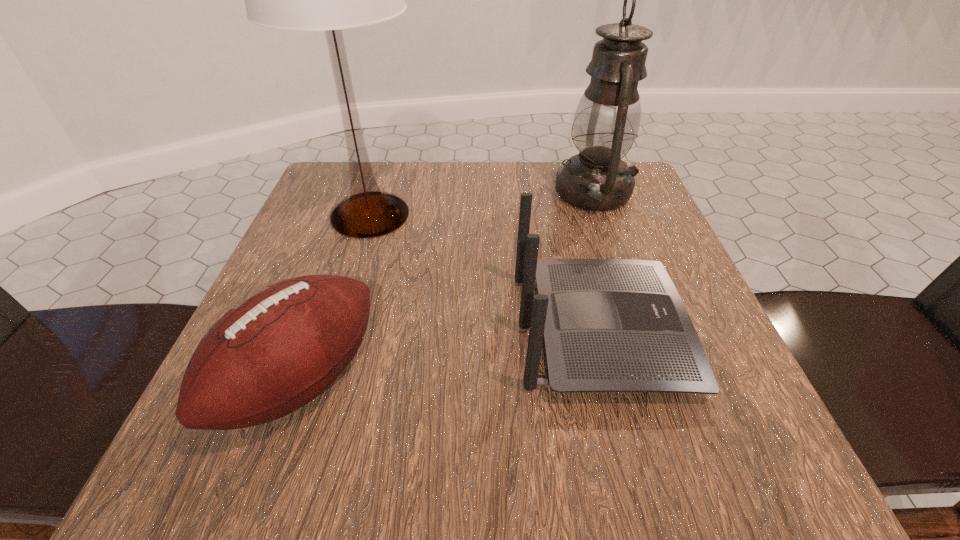
At what (x,y) coordinates should I click in order to perform the action: click on the tallest object. Please return your answer as a coordinate pair (x, y). Looking at the image, I should click on (329, 0).

The height and width of the screenshot is (540, 960). In order to click on the second tallest object in this screenshot , I will do `click(606, 122)`.

Find the location of `router`. router is located at coordinates (610, 325).

Find the location of `the shortest object`. the shortest object is located at coordinates (276, 350).

You are a GUI agent. You are given a task and a screenshot of the screen. Output one action in this format:
    pyautogui.click(x=<x>, y=<y>)
    Task: Click on the free space located above the cylindrical shade of the tallest object
    
    Given the screenshot: What is the action you would take?
    pyautogui.click(x=299, y=442)

Locate an element on the screen. free region located 0.360m on the left of the oil lamp is located at coordinates (395, 192).

I want to click on vacant space located 0.120m on the right of the football (American), so click(454, 381).

Where is `table lamp located in the far edge section of the desktop`? This screenshot has width=960, height=540. table lamp located in the far edge section of the desktop is located at coordinates (329, 0).

Find the location of a particular element. The image size is (960, 540). oil lamp at the far edge is located at coordinates (606, 122).

Find the location of a particular element. The width and height of the screenshot is (960, 540). object at the near edge is located at coordinates (276, 350).